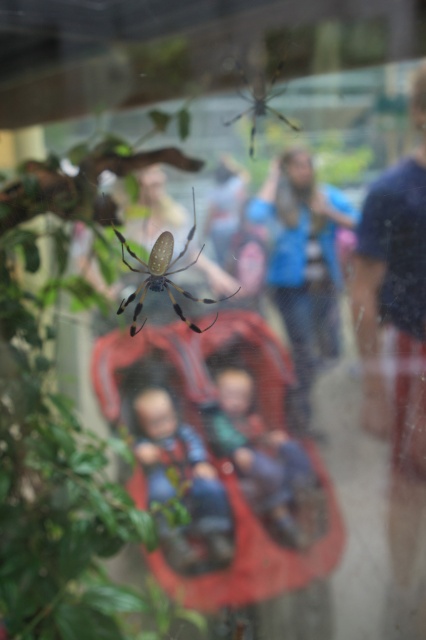
Question: Among these points, which one is farthest from the camera?

Choices:
 (A) (222, 496)
 (B) (141, 324)
 (C) (273, 442)
 (D) (299, 296)

Answer: (B)

Question: Is blue fabric jacket at center behind shiny golden spider at center?

Choices:
 (A) no
 (B) yes

Answer: (A)

Question: Where is blue fabric jacket at center located in relation to soft green fabric at center in the image?

Choices:
 (A) right
 (B) left

Answer: (A)

Question: Is blue fabric jacket at center bigger than blue denim pants at center?

Choices:
 (A) yes
 (B) no

Answer: (A)

Question: Which point is farther from the camera taking this photo?

Choices:
 (A) (267, 465)
 (B) (221, 548)

Answer: (A)

Question: Which of these objects is positioned closest to the shiny golden spider at center?

Choices:
 (A) soft green fabric at center
 (B) blue fabric jacket at center
 (C) yellow and black silk spider at upper center

Answer: (B)